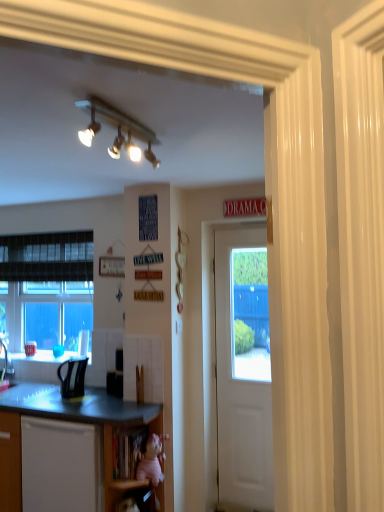
The width and height of the screenshot is (384, 512). I want to click on vacant space positioned to the left of matte black kettle at left, so click(x=50, y=397).